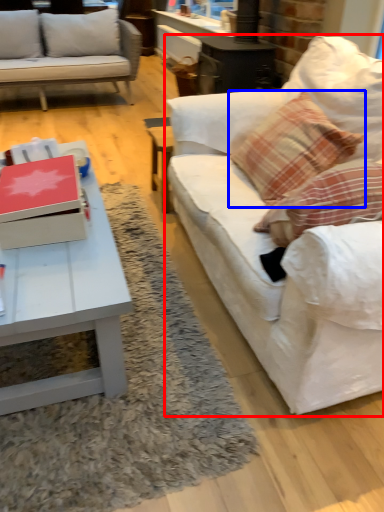
Question: Which of the following is the closest to the observer, studio couch (highlighted by a red box) or pillow (highlighted by a blue box)?

Choices:
 (A) studio couch
 (B) pillow

Answer: (A)